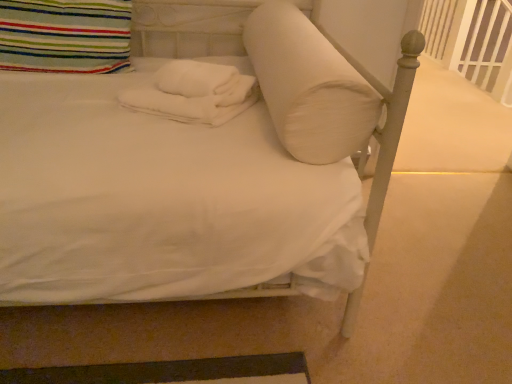
Question: Do you think white plastic balustrade at upper right is within white soft pillow at center, the second pillow when ordered from left to right, or outside of it?

Choices:
 (A) outside
 (B) inside

Answer: (A)

Question: From the image's perspective, is white plastic balustrade at upper right located above or below white soft pillow at center, which is counted as the first pillow, starting from the right?

Choices:
 (A) above
 (B) below

Answer: (A)

Question: Which is nearer to the white soft towels at center?

Choices:
 (A) white plastic balustrade at upper right
 (B) striped fabric pillow at upper left, the first pillow in the left-to-right sequence
 (C) white soft pillow at center, which is counted as the first pillow, starting from the right

Answer: (C)

Question: Which object is the closest to the white soft pillow at center, the second pillow when ordered from left to right?

Choices:
 (A) white soft towels at center
 (B) white plastic balustrade at upper right
 (C) striped fabric pillow at upper left, the 2th pillow positioned from the right

Answer: (A)